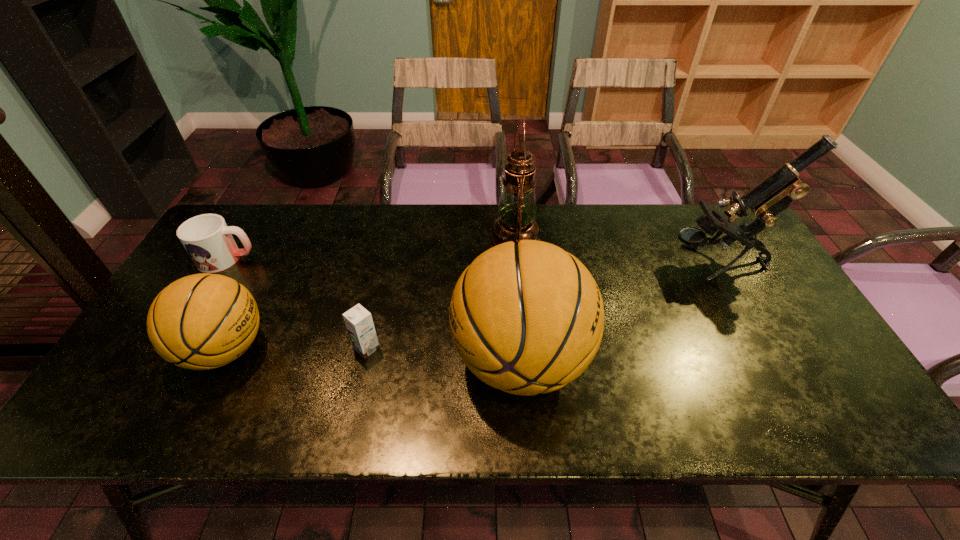
Find the location of `free space that satisfies the following two spatial constraints: 1. on the front side of the oil lamp; 2. on the surface of the shorter basketball near the brand logo`. free space that satisfies the following two spatial constraints: 1. on the front side of the oil lamp; 2. on the surface of the shorter basketball near the brand logo is located at coordinates (524, 349).

Find the location of a particular element. free spot that satisfies the following two spatial constraints: 1. through the eyepiece of the rightmost object; 2. on the front side of the third object from left to right is located at coordinates (764, 348).